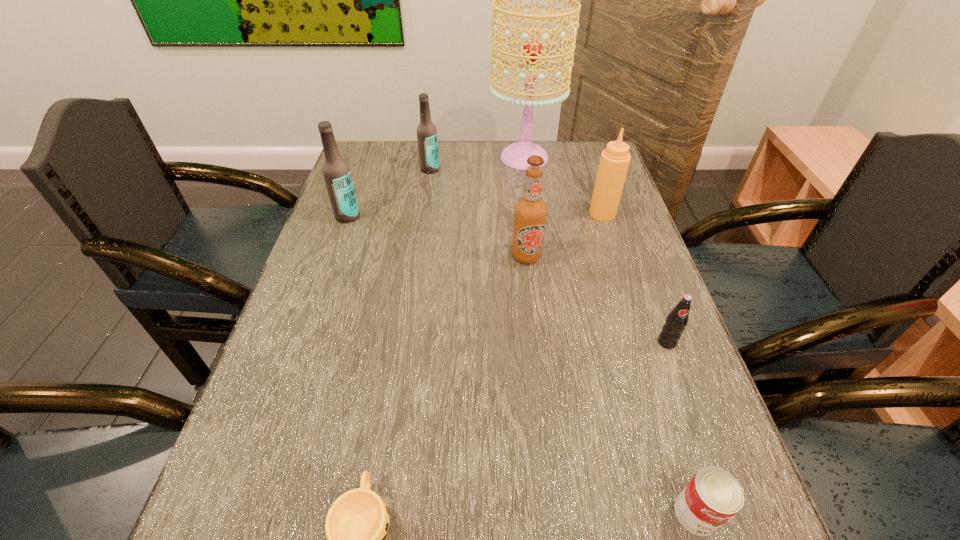
Identify the location of lampshade. (515, 155).

What are the coordinates of `the rightmost beer bottle` in the screenshot? It's located at (530, 211).

This screenshot has width=960, height=540. In order to click on the nearest beer bottle in this screenshot , I will do `click(530, 211)`.

This screenshot has height=540, width=960. I want to click on the second farthest beer bottle, so click(336, 172).

Where is `the leftmost beer bottle`? Image resolution: width=960 pixels, height=540 pixels. the leftmost beer bottle is located at coordinates (336, 172).

Where is `condiment`? condiment is located at coordinates (615, 159).

At what (x,y) coordinates should I click in order to perform the action: click on the farthest beer bottle. Please return your answer as a coordinate pair (x, y). Looking at the image, I should click on (427, 140).

This screenshot has width=960, height=540. I want to click on the third nearest object, so click(677, 320).

This screenshot has width=960, height=540. Find the location of `pop`. pop is located at coordinates (677, 320).

You are a GUI agent. You are given a task and a screenshot of the screen. Output one action in this format:
    pyautogui.click(x=<x>, y=<y>)
    Task: Click on the can
    This screenshot has height=540, width=960.
    Given the screenshot: What is the action you would take?
    pyautogui.click(x=713, y=496)